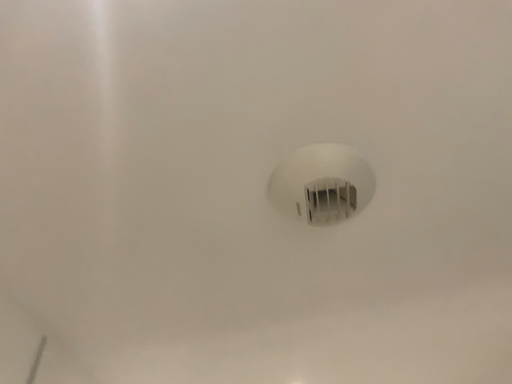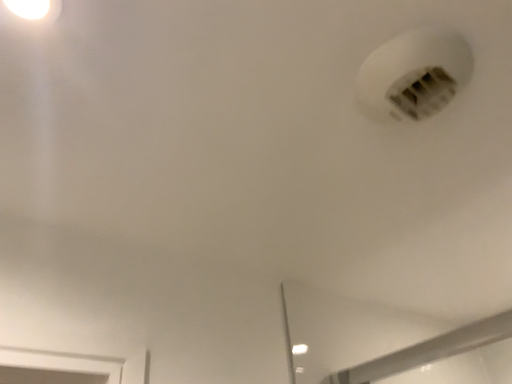
Question: How did the camera likely rotate when shooting the video?

Choices:
 (A) rotated downward
 (B) rotated upward

Answer: (A)